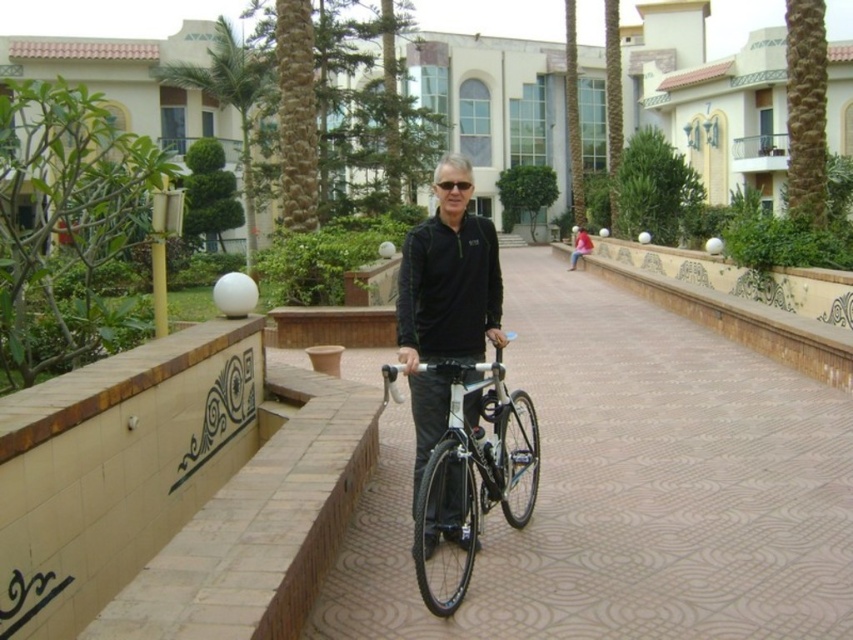
You are a photographer trying to capture a closeup of the black matte jacket at center while also including the shiny metallic bicycle at center in the shot. Given their relative sizes, which object should you focus on to ensure both are in frame without cropping?

The black matte jacket at center is wider than the shiny metallic bicycle at center. To include both without cropping, focus on the black matte jacket at center as it takes up more space in the frame.

You are a photographer trying to capture the man in the black matte jacket at center. Where should you position your camera to ensure the jacket is centered in the frame?

The black matte jacket at center is already positioned at point (445, 308), which is very close to the center of the frame. To ensure the jacket is centered, position the camera so that the jacket aligns with the frame center at coordinates approximately (426, 320).

You are a photographer trying to capture a clear shot of both the shiny metallic bicycle at center and the green leafy palm tree at upper left. Which object should you focus on first to ensure both are in sharp focus?

You should focus on the shiny metallic bicycle at center first because it is closer to the viewer than the green leafy palm tree at upper left. By focusing on the closer object, the background object may still be in acceptable focus depending on the lens aperture used.